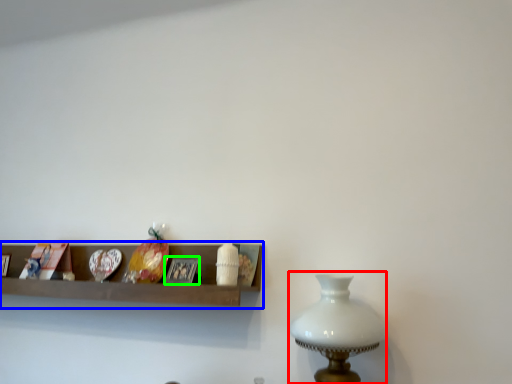
Question: Which object is the farthest from table lamp (highlighted by a red box)? Choose among these: shelf (highlighted by a blue box) or picture frame (highlighted by a green box).

Choices:
 (A) shelf
 (B) picture frame

Answer: (B)